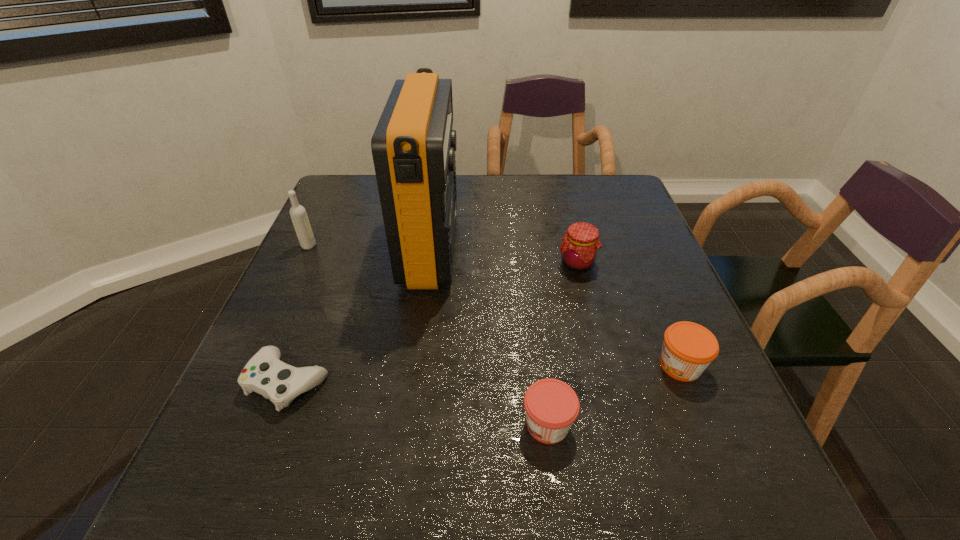
This screenshot has width=960, height=540. In order to click on vacant area between the fourth object from left to right and the fourth object from right to left in this screenshot , I will do `click(490, 336)`.

Locate an element on the screen. free space between the tallest jam and the shortest object is located at coordinates (433, 323).

Where is `empty space between the shortest object and the vodka`? empty space between the shortest object and the vodka is located at coordinates (299, 314).

Locate an element on the screen. This screenshot has height=540, width=960. unoccupied area between the second farthest jam and the nearest jam is located at coordinates (614, 395).

Where is `free point between the third object from left to right and the leftmost jam`? This screenshot has width=960, height=540. free point between the third object from left to right and the leftmost jam is located at coordinates (490, 336).

I want to click on free space between the fifth shortest object and the control, so click(299, 314).

The height and width of the screenshot is (540, 960). What are the coordinates of `free space between the vodka and the rightmost object` in the screenshot? It's located at (494, 306).

Locate an element on the screen. free area in between the second tallest object and the nearest jam is located at coordinates (428, 335).

Image resolution: width=960 pixels, height=540 pixels. I want to click on empty location between the radio receiver and the shortest object, so click(x=360, y=315).

This screenshot has width=960, height=540. In order to click on object that is the second closest to the rightmost jam in this screenshot , I will do `click(579, 249)`.